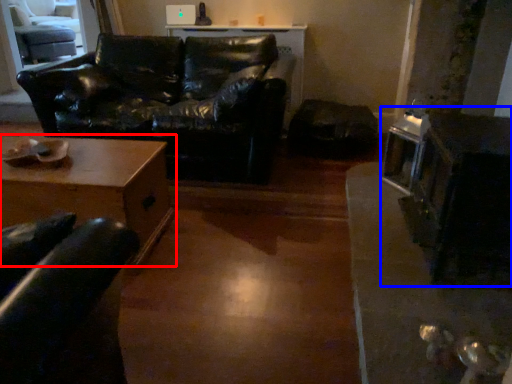
Question: Which point is closer to the camera, table (highlighted by a red box) or appliance (highlighted by a blue box)?

Choices:
 (A) table
 (B) appliance

Answer: (B)